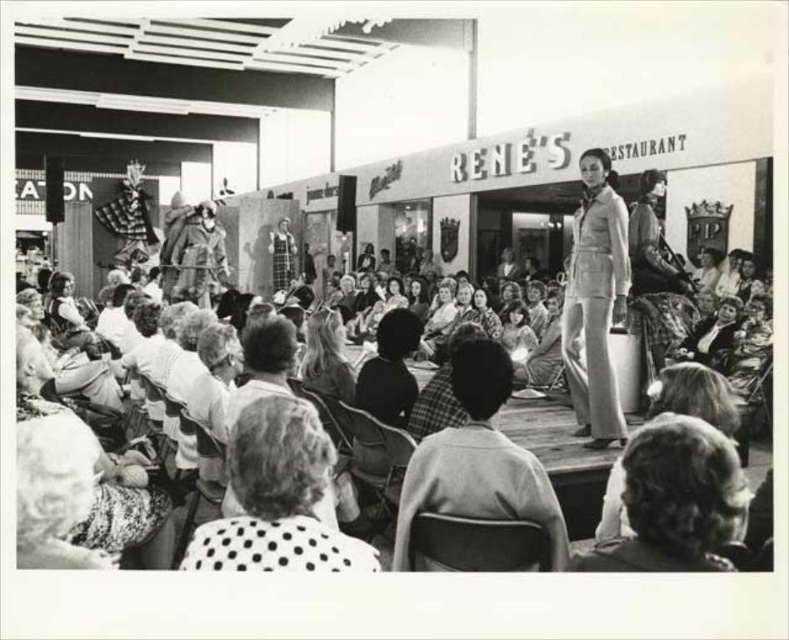
Question: Which point is farther to the camera?

Choices:
 (A) plaid fabric jacket at center
 (B) light beige fabric suit at center
 (C) polka dot fabric at lower center

Answer: (B)

Question: Which object appears farthest from the camera in this image?

Choices:
 (A) plaid fabric jacket at center
 (B) curly hair at center
 (C) white textured hair at lower left

Answer: (A)

Question: Which object appears closest to the camera in this image?

Choices:
 (A) white textured hair at lower left
 (B) polka dot fabric at lower center
 (C) dark hair at center

Answer: (B)

Question: From the image, what is the correct spatial relationship of plaid fabric jacket at center in relation to white textured hair at lower left?

Choices:
 (A) left
 (B) right

Answer: (B)

Question: In this image, where is curly hair at center located relative to plaid fabric jacket at center?

Choices:
 (A) right
 (B) left

Answer: (A)

Question: Does curly hair at center have a smaller size compared to light beige fabric suit at center?

Choices:
 (A) no
 (B) yes

Answer: (B)